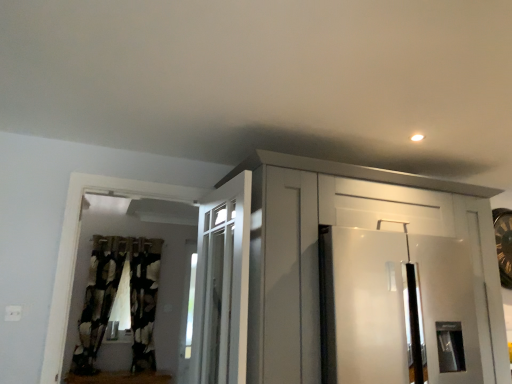
Where is `white glossy refrigerator at right`? The image size is (512, 384). white glossy refrigerator at right is located at coordinates (400, 280).

This screenshot has height=384, width=512. Describe the element at coordinates (400, 280) in the screenshot. I see `white glossy refrigerator at right` at that location.

Where is `white glossy refrigerator at right`? This screenshot has width=512, height=384. white glossy refrigerator at right is located at coordinates (400, 280).

The height and width of the screenshot is (384, 512). Identify the location of cabinetry that is on the right side of black textured curtain at left, the 2th curtain positioned from the left. (350, 276).

Measure the distance between white glossy cabinet at upper center and black textured curtain at left, arranged as the 1th curtain when viewed from the right.

white glossy cabinet at upper center and black textured curtain at left, arranged as the 1th curtain when viewed from the right, are 8.38 feet apart from each other.

Is white glossy cabinet at upper center further to camera compared to black textured curtain at left, the 2th curtain positioned from the left?

No, white glossy cabinet at upper center is in front of black textured curtain at left, the 2th curtain positioned from the left.

Is white glossy cabinet at upper center next to black textured curtain at left, arranged as the 1th curtain when viewed from the right?

No, white glossy cabinet at upper center is not touching black textured curtain at left, arranged as the 1th curtain when viewed from the right.

Is white glossy cabinet at upper center turned away from white glossy refrigerator at right?

Absolutely, white glossy cabinet at upper center is directed away from white glossy refrigerator at right.

From a real-world perspective, does white glossy cabinet at upper center sit lower than white glossy refrigerator at right?

Incorrect, from a real-world perspective, white glossy cabinet at upper center is higher than white glossy refrigerator at right.

Considering the relative sizes of white glossy cabinet at upper center and white glossy refrigerator at right in the image provided, is white glossy cabinet at upper center wider than white glossy refrigerator at right?

Indeed, white glossy cabinet at upper center has a greater width compared to white glossy refrigerator at right.

Is black textured curtain at left, arranged as the 1th curtain when viewed from the right, in contact with black textured curtain at left, which appears as the 1th curtain when viewed from the left?

No, black textured curtain at left, arranged as the 1th curtain when viewed from the right, is not beside black textured curtain at left, which appears as the 1th curtain when viewed from the left.

Can you confirm if black textured curtain at left, the 2th curtain positioned from the left, is positioned to the left of black textured curtain at left, which appears as the 1th curtain when viewed from the left?

In fact, black textured curtain at left, the 2th curtain positioned from the left, is to the right of black textured curtain at left, which appears as the 1th curtain when viewed from the left.

Could you tell me if black textured curtain at left, arranged as the 1th curtain when viewed from the right, is facing black textured curtain at left, the 2th curtain positioned from the right?

No, black textured curtain at left, arranged as the 1th curtain when viewed from the right, is not turned towards black textured curtain at left, the 2th curtain positioned from the right.

From the image's perspective, does black textured curtain at left, arranged as the 1th curtain when viewed from the right, appear lower than black textured curtain at left, the 2th curtain positioned from the right?

Yes, from the image's perspective, black textured curtain at left, arranged as the 1th curtain when viewed from the right, is below black textured curtain at left, the 2th curtain positioned from the right.

Which is more to the right, black textured curtain at left, which appears as the 1th curtain when viewed from the left, or black textured curtain at left, the 2th curtain positioned from the left?

black textured curtain at left, the 2th curtain positioned from the left, is more to the right.

Does black textured curtain at left, which appears as the 1th curtain when viewed from the left, lie in front of black textured curtain at left, the 2th curtain positioned from the left?

Yes, it is in front of black textured curtain at left, the 2th curtain positioned from the left.

Is black textured curtain at left, which appears as the 1th curtain when viewed from the left, outside of black textured curtain at left, arranged as the 1th curtain when viewed from the right?

Yes, black textured curtain at left, which appears as the 1th curtain when viewed from the left, is located beyond the bounds of black textured curtain at left, arranged as the 1th curtain when viewed from the right.

Would you say black textured curtain at left, which appears as the 1th curtain when viewed from the left, is inside or outside white glossy cabinet at upper center?

black textured curtain at left, which appears as the 1th curtain when viewed from the left, is located beyond the bounds of white glossy cabinet at upper center.

Is black textured curtain at left, the 2th curtain positioned from the right, placed right next to white glossy cabinet at upper center?

black textured curtain at left, the 2th curtain positioned from the right, and white glossy cabinet at upper center are not in contact.

From a real-world perspective, does black textured curtain at left, the 2th curtain positioned from the right, stand above white glossy cabinet at upper center?

Incorrect, from a real-world perspective, black textured curtain at left, the 2th curtain positioned from the right, is lower than white glossy cabinet at upper center.

From the image's perspective, is black textured curtain at left, which appears as the 1th curtain when viewed from the left, positioned above or below white glossy cabinet at upper center?

Clearly, from the image's perspective, black textured curtain at left, which appears as the 1th curtain when viewed from the left, is below white glossy cabinet at upper center.

Is white glossy refrigerator at right smaller than black textured curtain at left, the 2th curtain positioned from the left?

Incorrect, white glossy refrigerator at right is not smaller in size than black textured curtain at left, the 2th curtain positioned from the left.

Between white glossy refrigerator at right and black textured curtain at left, arranged as the 1th curtain when viewed from the right, which one has larger width?

white glossy refrigerator at right is wider.

At what (x,y) coordinates should I click in order to perform the action: click on the 2nd curtain below the white glossy refrigerator at right (from the image's perspective). Please return your answer as a coordinate pair (x, y). Looking at the image, I should click on (144, 304).

In the scene shown: From the image's perspective, is white glossy refrigerator at right below black textured curtain at left, arranged as the 1th curtain when viewed from the right?

No, from the image's perspective, white glossy refrigerator at right is not below black textured curtain at left, arranged as the 1th curtain when viewed from the right.

Does white glossy refrigerator at right come in front of black textured curtain at left, the 2th curtain positioned from the right?

Yes, white glossy refrigerator at right is in front of black textured curtain at left, the 2th curtain positioned from the right.

Is the surface of white glossy refrigerator at right in direct contact with black textured curtain at left, which appears as the 1th curtain when viewed from the left?

They are not placed beside each other.

Who is shorter, white glossy refrigerator at right or black textured curtain at left, which appears as the 1th curtain when viewed from the left?

With less height is white glossy refrigerator at right.

Would you say white glossy refrigerator at right is to the left or to the right of black textured curtain at left, the 2th curtain positioned from the right, in the picture?

In the image, white glossy refrigerator at right appears on the right side of black textured curtain at left, the 2th curtain positioned from the right.

This screenshot has height=384, width=512. Identify the location of the 2nd curtain located beneath the white glossy cabinet at upper center (from a real-world perspective). (144, 304).

Locate an element on the screen. cabinetry located in front of the white glossy refrigerator at right is located at coordinates (350, 276).

Estimate the real-world distances between objects in this image. Which object is further from white glossy refrigerator at right, black textured curtain at left, which appears as the 1th curtain when viewed from the left, or white glossy cabinet at upper center?

black textured curtain at left, which appears as the 1th curtain when viewed from the left, is further to white glossy refrigerator at right.

When comparing their distances from black textured curtain at left, which appears as the 1th curtain when viewed from the left, does white glossy refrigerator at right or black textured curtain at left, the 2th curtain positioned from the left, seem further?

Among the two, white glossy refrigerator at right is located further to black textured curtain at left, which appears as the 1th curtain when viewed from the left.

From the image, which object appears to be farther from black textured curtain at left, arranged as the 1th curtain when viewed from the right, black textured curtain at left, which appears as the 1th curtain when viewed from the left, or white glossy cabinet at upper center?

Based on the image, white glossy cabinet at upper center appears to be further to black textured curtain at left, arranged as the 1th curtain when viewed from the right.

Estimate the real-world distances between objects in this image. Which object is closer to white glossy refrigerator at right, black textured curtain at left, arranged as the 1th curtain when viewed from the right, or white glossy cabinet at upper center?

Among the two, white glossy cabinet at upper center is located nearer to white glossy refrigerator at right.

Which object lies nearer to the anchor point black textured curtain at left, the 2th curtain positioned from the right, white glossy cabinet at upper center or white glossy refrigerator at right?

white glossy cabinet at upper center.

Based on their spatial positions, is black textured curtain at left, which appears as the 1th curtain when viewed from the left, or white glossy refrigerator at right further from black textured curtain at left, the 2th curtain positioned from the left?

The object further to black textured curtain at left, the 2th curtain positioned from the left, is white glossy refrigerator at right.

When comparing their distances from black textured curtain at left, which appears as the 1th curtain when viewed from the left, does black textured curtain at left, the 2th curtain positioned from the left, or white glossy cabinet at upper center seem further?

The object further to black textured curtain at left, which appears as the 1th curtain when viewed from the left, is white glossy cabinet at upper center.

Estimate the real-world distances between objects in this image. Which object is closer to white glossy refrigerator at right, white glossy cabinet at upper center or black textured curtain at left, which appears as the 1th curtain when viewed from the left?

white glossy cabinet at upper center.

The width and height of the screenshot is (512, 384). Identify the location of door between white glossy cabinet at upper center and black textured curtain at left, arranged as the 1th curtain when viewed from the right, in the front-back direction. (400, 280).

I want to click on curtain between white glossy cabinet at upper center and black textured curtain at left, arranged as the 1th curtain when viewed from the right, in the front-back direction, so click(x=119, y=300).

Locate an element on the screen. The image size is (512, 384). cabinetry between black textured curtain at left, which appears as the 1th curtain when viewed from the left, and white glossy refrigerator at right, in the horizontal direction is located at coordinates (350, 276).

This screenshot has height=384, width=512. What are the coordinates of `curtain between black textured curtain at left, which appears as the 1th curtain when viewed from the left, and white glossy refrigerator at right, in the horizontal direction` in the screenshot? It's located at (144, 304).